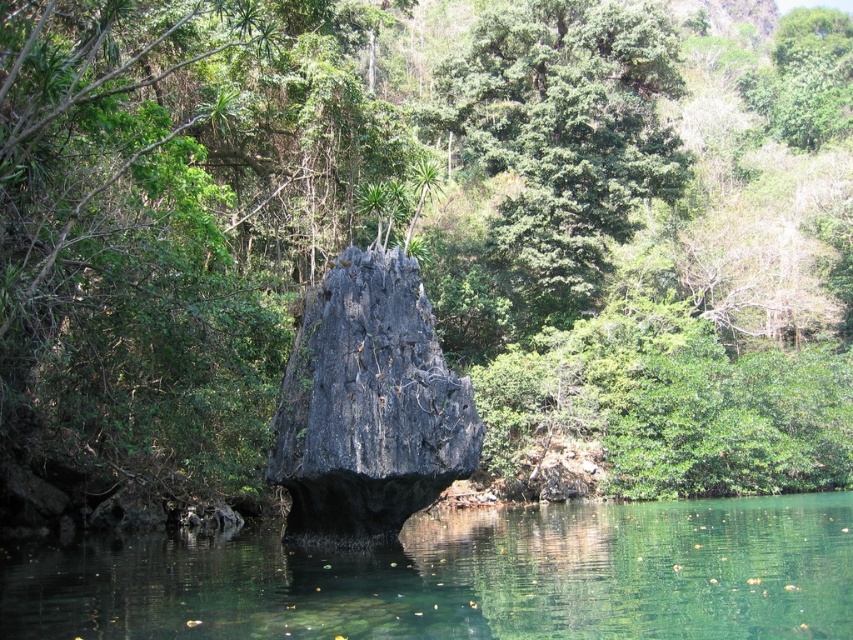
Question: Which is farther from the dark gray stone at center?

Choices:
 (A) green translucent water at center
 (B) green leafy tree at upper center

Answer: (B)

Question: Is green translucent water at center to the left of green leafy tree at upper center from the viewer's perspective?

Choices:
 (A) yes
 (B) no

Answer: (A)

Question: Which point appears farthest from the camera in this image?

Choices:
 (A) (152, 620)
 (B) (366, 257)
 (C) (553, 3)

Answer: (C)

Question: Can you confirm if green leafy tree at upper center is positioned to the right of dark gray stone at center?

Choices:
 (A) yes
 (B) no

Answer: (A)

Question: Is green translucent water at center above dark gray stone at center?

Choices:
 (A) yes
 (B) no

Answer: (B)

Question: Which point appears closest to the camera in this image?

Choices:
 (A) (494, 515)
 (B) (318, 460)
 (C) (579, 17)

Answer: (B)